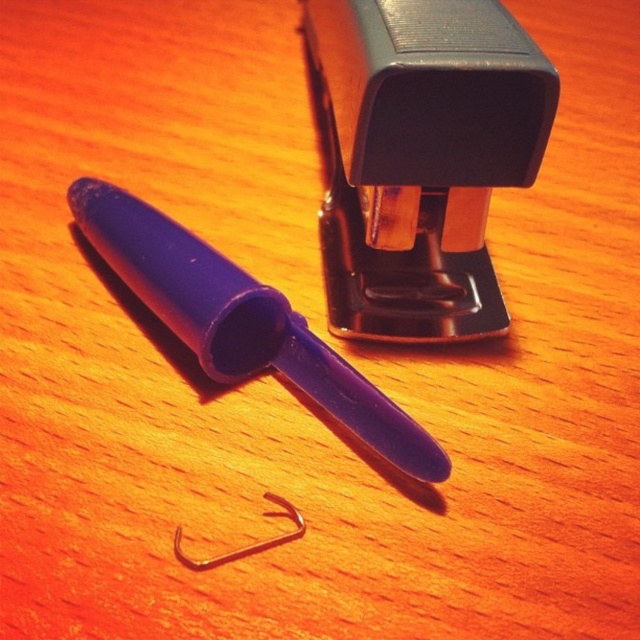
Who is shorter, black plastic stapler at upper center or purple plastic pen at center?

Standing shorter between the two is purple plastic pen at center.

Is black plastic stapler at upper center below purple plastic pen at center?

No.

Where is `black plastic stapler at upper center`? The height and width of the screenshot is (640, 640). black plastic stapler at upper center is located at coordinates (422, 157).

Is black plastic stapler at upper center behind silver metallic hook at center?

No, it is in front of silver metallic hook at center.

Is black plastic stapler at upper center to the left of silver metallic hook at center from the viewer's perspective?

Incorrect, black plastic stapler at upper center is not on the left side of silver metallic hook at center.

Identify the location of black plastic stapler at upper center. (422, 157).

Identify the location of purple plastic pen at center. Image resolution: width=640 pixels, height=640 pixels. (241, 321).

Can you confirm if purple plastic pen at center is positioned above silver metallic hook at center?

Yes, purple plastic pen at center is above silver metallic hook at center.

Is point (259, 364) positioned in front of point (262, 493)?

No, (259, 364) is behind (262, 493).

Locate an element on the screen. purple plastic pen at center is located at coordinates (241, 321).